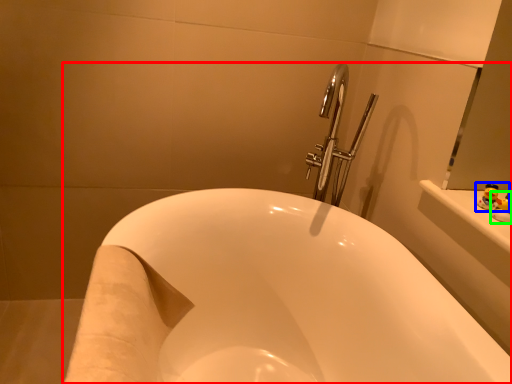
Question: Based on their relative distances, which object is nearer to bathtub (highlighted by a red box)? Choose from toy (highlighted by a blue box) and toy (highlighted by a green box).

Choices:
 (A) toy
 (B) toy

Answer: (A)